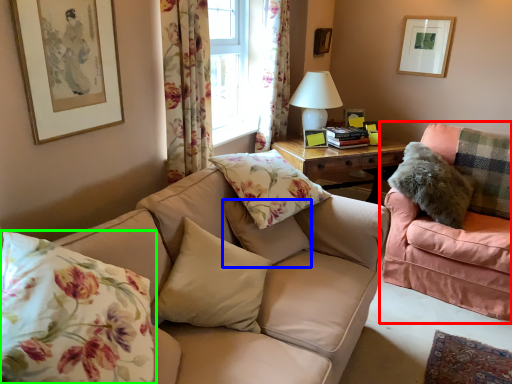
Question: Which object is the farthest from studio couch (highlighted by a red box)? Choose among these: pillow (highlighted by a blue box) or pillow (highlighted by a green box).

Choices:
 (A) pillow
 (B) pillow

Answer: (B)